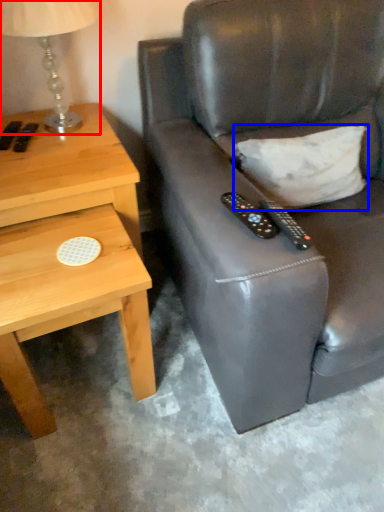
Question: Which point is further to the camera, table lamp (highlighted by a red box) or pillow (highlighted by a blue box)?

Choices:
 (A) table lamp
 (B) pillow

Answer: (B)